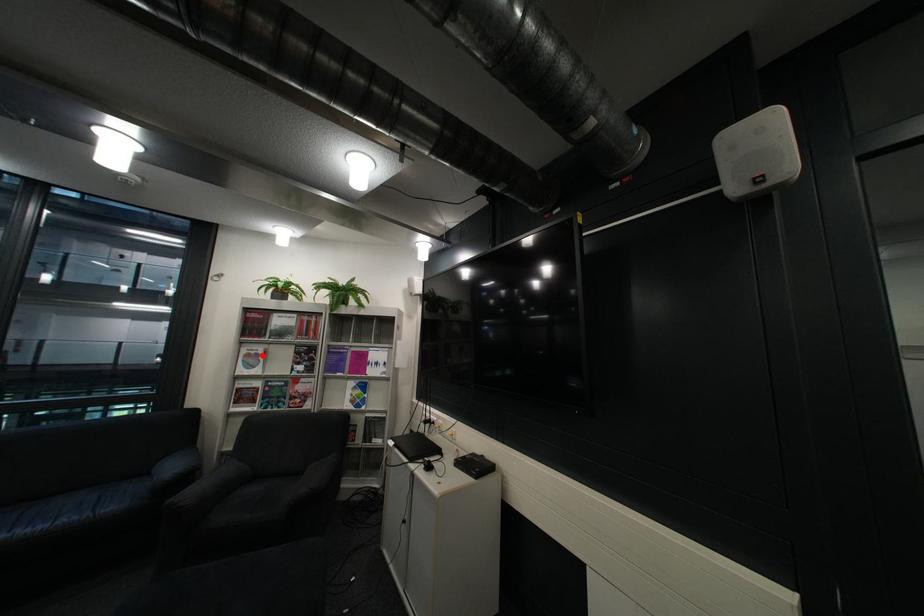
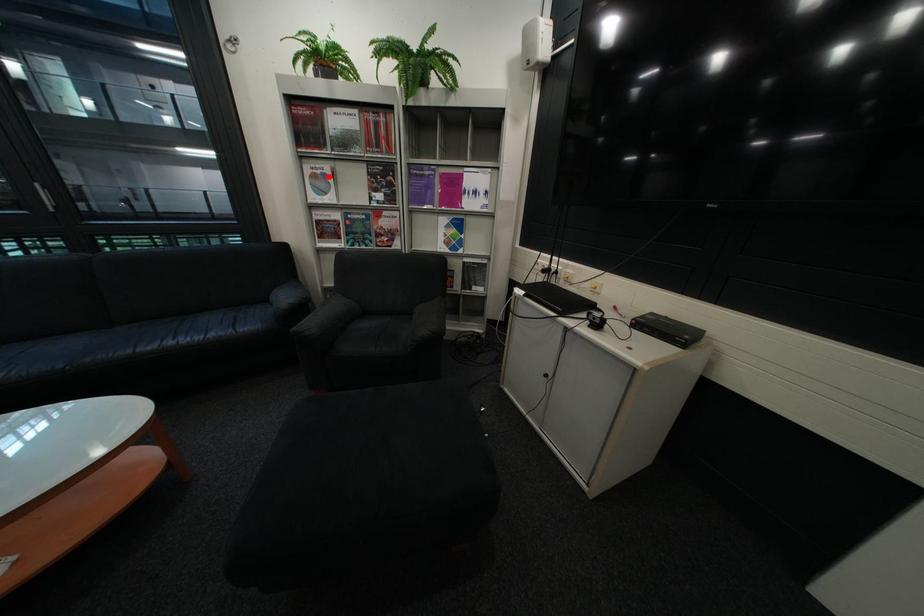
I am providing you with two images of the same scene from different viewpoints. A red point is marked on the first image and another point is marked on the second image. Are the points marked in image1 and image2 representing the same 3D position?

Yes